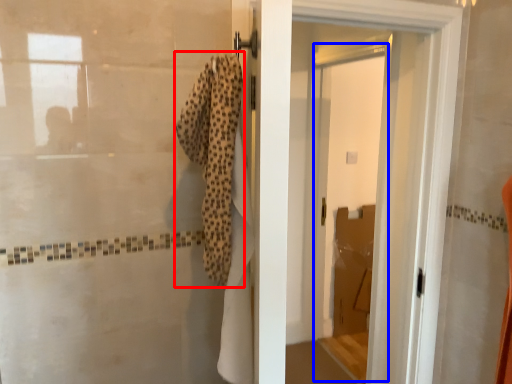
Question: Which object appears closest to the camera in this image, bath towel (highlighted by a red box) or screen door (highlighted by a blue box)?

Choices:
 (A) bath towel
 (B) screen door

Answer: (A)